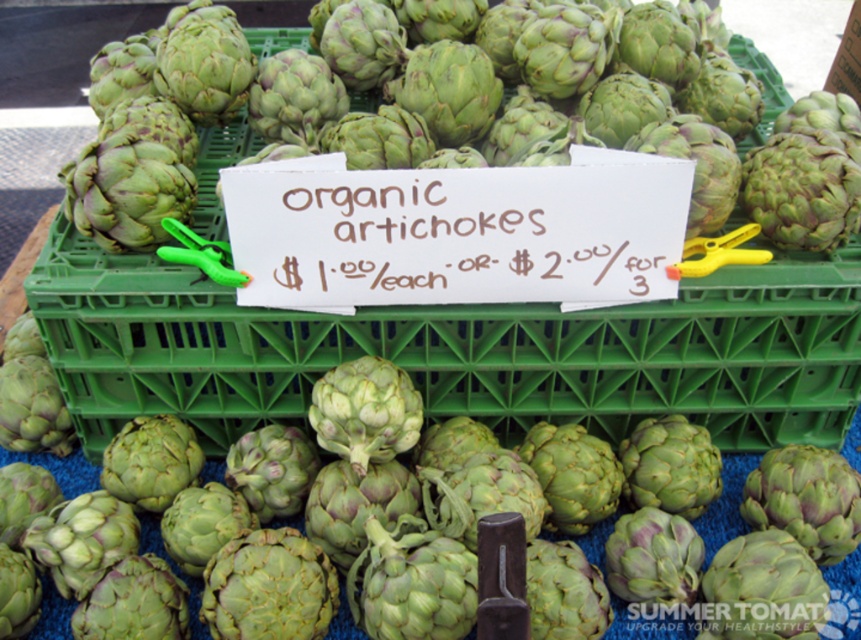
Does green plastic crate at center come in front of green matte artichoke at center?

No, green plastic crate at center is further to the viewer.

Describe the element at coordinates (459, 352) in the screenshot. I see `green plastic crate at center` at that location.

Where is `green plastic crate at center`? green plastic crate at center is located at coordinates (459, 352).